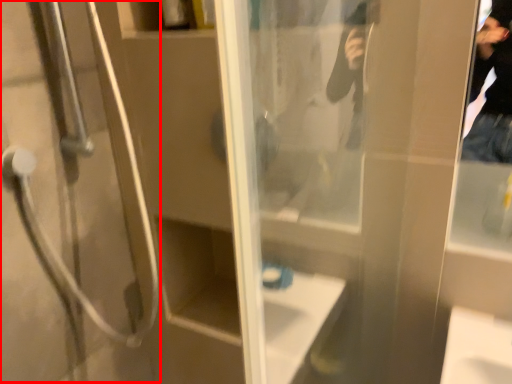
Question: Considering the relative positions of shower door (annotated by the red box) and screen door in the image provided, where is shower door (annotated by the red box) located with respect to the staircase?

Choices:
 (A) right
 (B) left

Answer: (B)